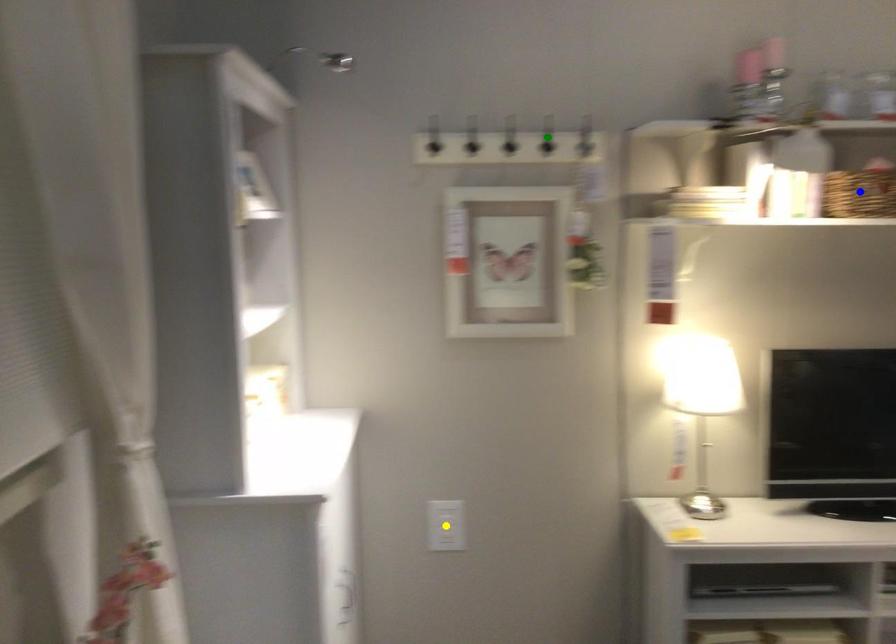
Order these from nearest to farthest:
green point | yellow point | blue point

blue point < green point < yellow point